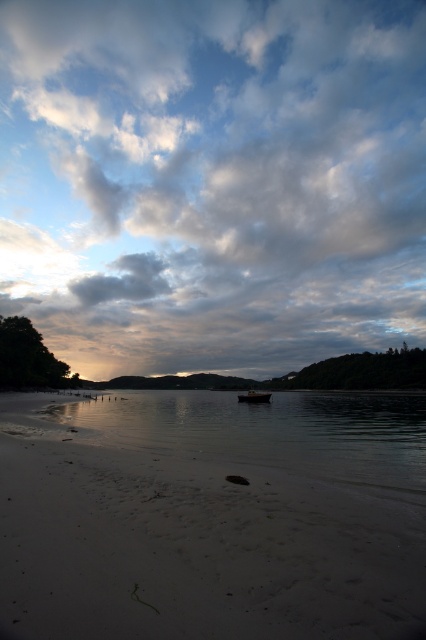
Can you confirm if sandy beach at lower left is positioned below wooden boat at center?

No.

Does point (362, 570) come behind point (267, 392)?

No, it is in front of (267, 392).

Who is more distant from viewer, [28,396] or [253,396]?

The point [28,396] is more distant.

What are the coordinates of `sandy beach at lower left` in the screenshot? It's located at (192, 547).

In the scene shown: Between cloudy sky at upper center and clear water at lower center, which one is positioned lower?

Positioned lower is clear water at lower center.

Can you confirm if cloudy sky at upper center is taller than clear water at lower center?

Correct, cloudy sky at upper center is much taller as clear water at lower center.

Which is in front, point (359, 332) or point (331, 401)?

Point (331, 401)

The width and height of the screenshot is (426, 640). Identify the location of cloudy sky at upper center. (213, 180).

Is point (328, 451) closer to viewer compared to point (262, 397)?

Yes, point (328, 451) is in front of point (262, 397).

Looking at this image, is the position of clear water at lower center less distant than that of wooden boat at center?

Yes.

Who is more forward, (152, 422) or (259, 400)?

Positioned in front is point (152, 422).

The image size is (426, 640). Find the location of `clear water at lower center`. clear water at lower center is located at coordinates (271, 433).